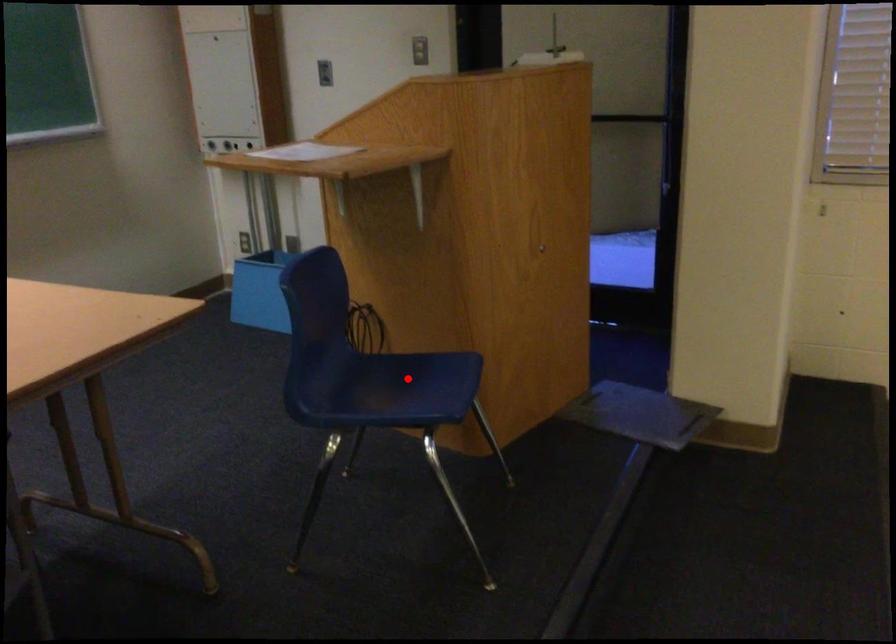
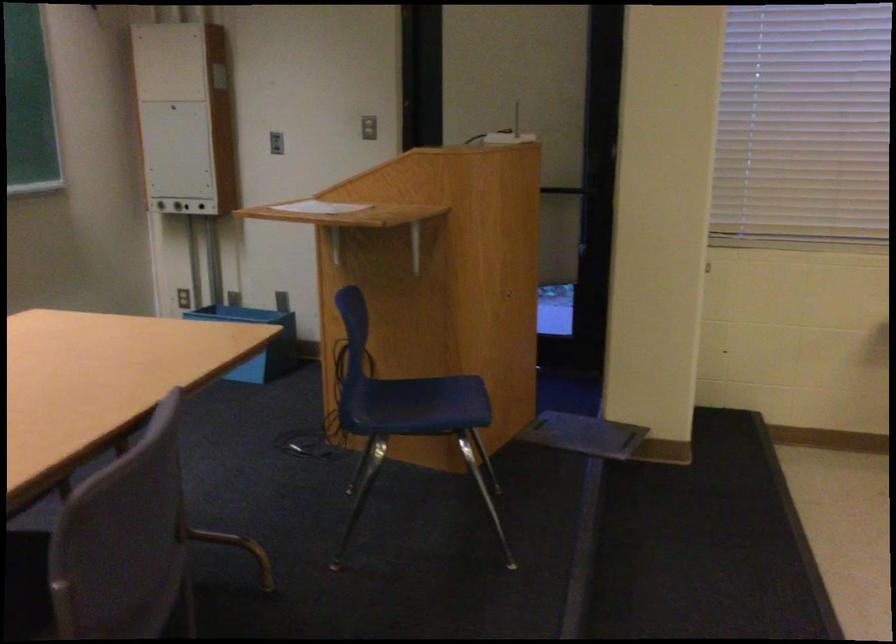
Find the pixel in the second image that matches the highlighted location in the first image.

(424, 398)